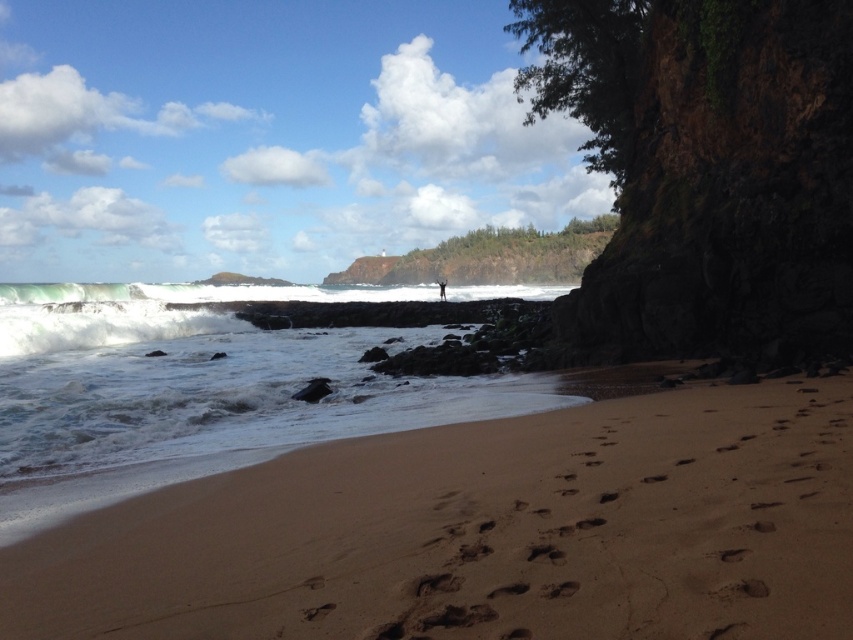
Does sandy beach at lower left have a greater height compared to white frothy water at lower left?

In fact, sandy beach at lower left may be shorter than white frothy water at lower left.

Is sandy beach at lower left positioned at the back of white frothy water at lower left?

No, sandy beach at lower left is closer to the viewer.

The image size is (853, 640). What are the coordinates of `sandy beach at lower left` in the screenshot? It's located at (485, 532).

I want to click on sandy beach at lower left, so click(485, 532).

Measure the distance between point (236, 323) and camera.

34.72 meters

Can you confirm if white frothy water at lower left is positioned to the right of brown textured person at center?

In fact, white frothy water at lower left is to the left of brown textured person at center.

The image size is (853, 640). Describe the element at coordinates (204, 376) in the screenshot. I see `white frothy water at lower left` at that location.

You are a GUI agent. You are given a task and a screenshot of the screen. Output one action in this format:
    pyautogui.click(x=<x>, y=<y>)
    Task: Click on the white frothy water at lower left
    Image resolution: width=853 pixels, height=640 pixels.
    Given the screenshot: What is the action you would take?
    pyautogui.click(x=204, y=376)

Is sandy beach at lower left thinner than brown textured person at center?

Yes, sandy beach at lower left is thinner than brown textured person at center.

Does sandy beach at lower left lie in front of brown textured person at center?

Yes.

Is point (357, 513) in front of point (440, 292)?

That is True.

This screenshot has height=640, width=853. I want to click on sandy beach at lower left, so click(x=485, y=532).